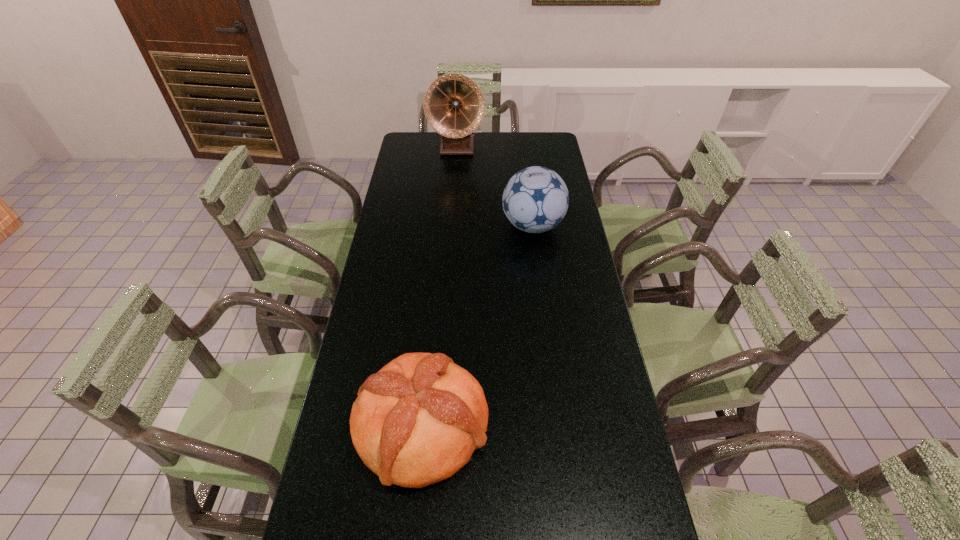
The width and height of the screenshot is (960, 540). In order to click on the farthest object in this screenshot , I will do `click(454, 106)`.

At what (x,y) coordinates should I click in order to perform the action: click on phonograph record. Please return your answer as a coordinate pair (x, y). Looking at the image, I should click on (454, 106).

The image size is (960, 540). What are the coordinates of `soccer ball` in the screenshot? It's located at (535, 200).

The height and width of the screenshot is (540, 960). Find the location of `the rightmost object`. the rightmost object is located at coordinates (535, 200).

Locate an element on the screen. The height and width of the screenshot is (540, 960). the nearest object is located at coordinates (417, 421).

At what (x,y) coordinates should I click in order to perform the action: click on the shortest object. Please return your answer as a coordinate pair (x, y). Image resolution: width=960 pixels, height=540 pixels. Looking at the image, I should click on (417, 421).

Locate an element on the screen. This screenshot has height=540, width=960. vacant space situated 0.080m on the horn of the farthest object is located at coordinates (455, 170).

What are the coordinates of `free region located on the side with brand of the rightmost object` in the screenshot? It's located at (451, 226).

In order to click on vacant position located on the side with brand of the rightmost object in this screenshot , I will do `click(444, 226)`.

Image resolution: width=960 pixels, height=540 pixels. Find the location of `free space located on the side with brand of the rightmost object`. free space located on the side with brand of the rightmost object is located at coordinates coord(414,226).